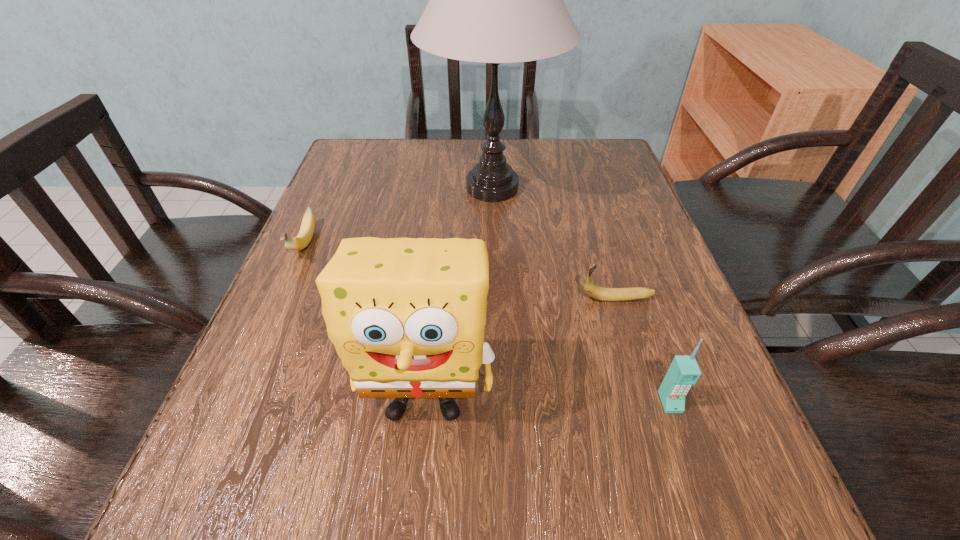
This screenshot has width=960, height=540. What are the coordinates of `vacant space positioned 0.380m at the stem of the nearer banana` in the screenshot? It's located at (371, 298).

Find the location of a particular element. This screenshot has width=960, height=540. vacant space situated 0.310m at the stem of the nearer banana is located at coordinates (409, 298).

You are a GUI agent. You are given a task and a screenshot of the screen. Output one action in this format:
    pyautogui.click(x=<x>, y=<y>)
    Task: Click on the vacant space positioned at the stem of the nearer banana
    This screenshot has height=540, width=960.
    Given the screenshot: What is the action you would take?
    pyautogui.click(x=526, y=298)

You are a GUI agent. You are given a task and a screenshot of the screen. Output one action in this format:
    pyautogui.click(x=<x>, y=<y>)
    Task: Click on the vacant area situated at the stem of the leftmost object
    
    Given the screenshot: What is the action you would take?
    pyautogui.click(x=272, y=317)

Locate an element on the screen. object present at the far edge is located at coordinates (494, 0).

Where is `object at the left edge`? object at the left edge is located at coordinates (301, 241).

The height and width of the screenshot is (540, 960). Find the location of `cellular telephone at the right edge`. cellular telephone at the right edge is located at coordinates (684, 371).

In order to click on banana that is at the right edge in this screenshot , I will do pos(599,293).

Locate an element on the screen. Image resolution: width=960 pixels, height=540 pixels. vacant space at the far edge is located at coordinates (431, 167).

Image resolution: width=960 pixels, height=540 pixels. I want to click on free space at the near edge, so click(478, 490).